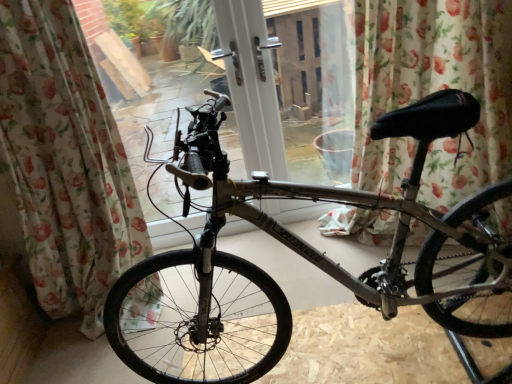
Question: From the image's perspective, is silver metallic bicycle at center above or below floral fabric curtain at center, arranged as the second curtain when viewed from the left?

Choices:
 (A) above
 (B) below

Answer: (B)

Question: Based on their positions, is silver metallic bicycle at center located to the left or right of floral fabric curtain at center, arranged as the second curtain when viewed from the left?

Choices:
 (A) left
 (B) right

Answer: (A)

Question: Which object is positioned farthest from the floral fabric curtain at center, positioned as the first curtain in right-to-left order?

Choices:
 (A) floral fabric curtain at left, acting as the 2th curtain starting from the right
 (B) silver metallic bicycle at center

Answer: (A)

Question: Estimate the real-world distances between objects in this image. Which object is farther from the floral fabric curtain at left, acting as the 2th curtain starting from the right?

Choices:
 (A) silver metallic bicycle at center
 (B) floral fabric curtain at center, arranged as the second curtain when viewed from the left

Answer: (B)